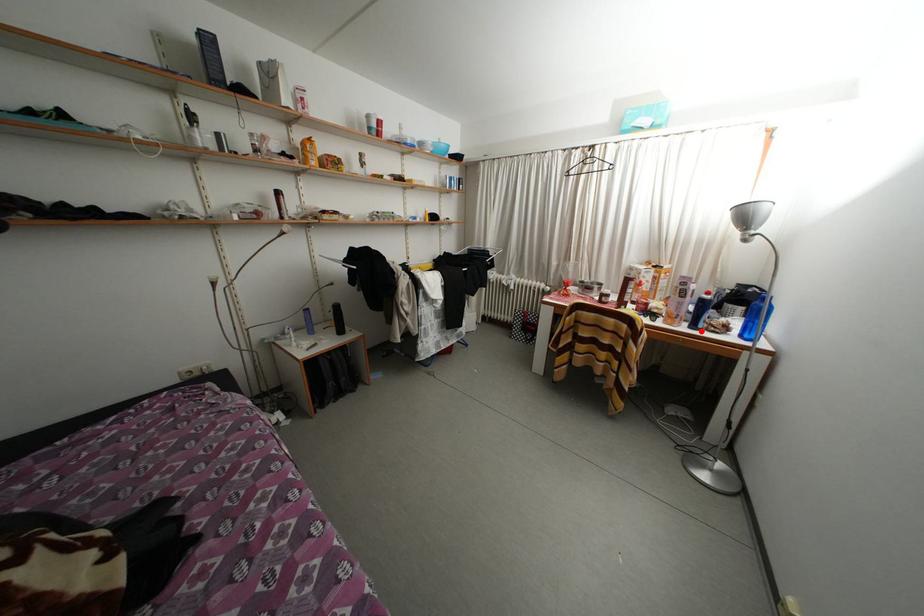
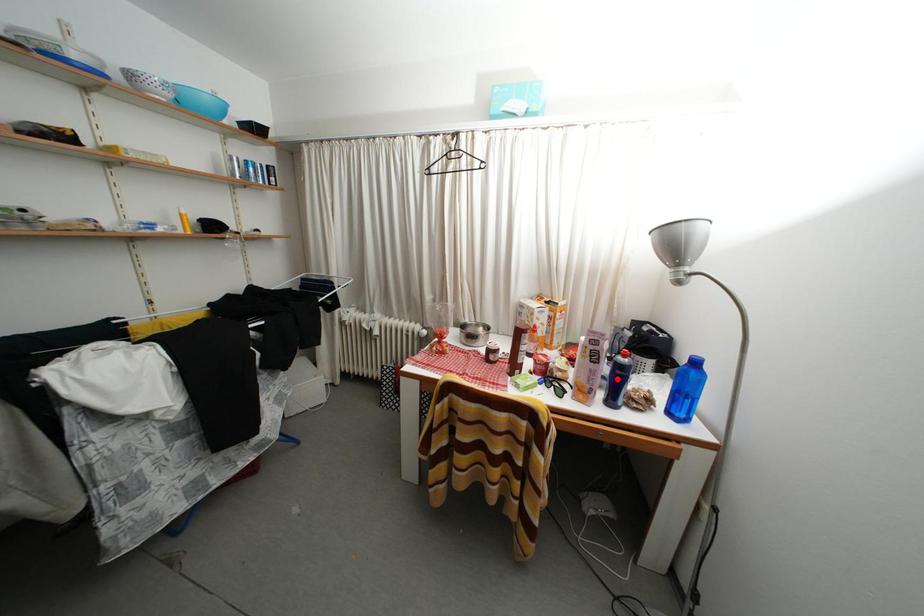
I am providing you with two images of the same scene from different viewpoints. A red point is marked on the first image and another point is marked on the second image. Are the points marked in image1 and image2 representing the same 3D position?

No